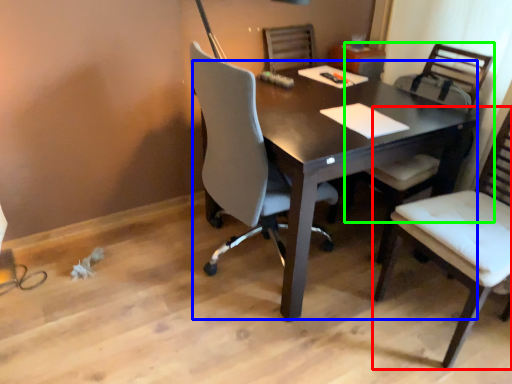
Question: Considering the real-world distances, which object is farthest from chair (highlighted by a red box)? desk (highlighted by a blue box) or chair (highlighted by a green box)?

Choices:
 (A) desk
 (B) chair

Answer: (A)